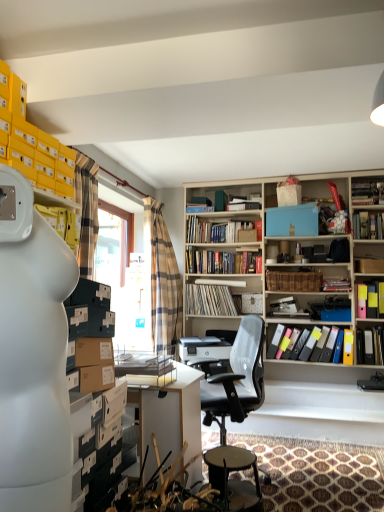
Identify the location of spots to the right of black mesh office chair at center. This screenshot has height=512, width=384. (307, 477).